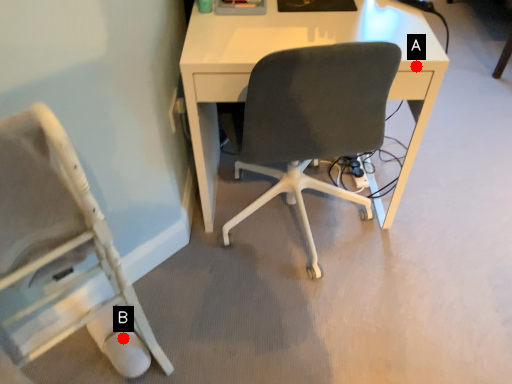
Question: Two points are circled on the image, labeled by A and B beside each circle. Which point is closer to the camera?

Choices:
 (A) A is closer
 (B) B is closer

Answer: (A)